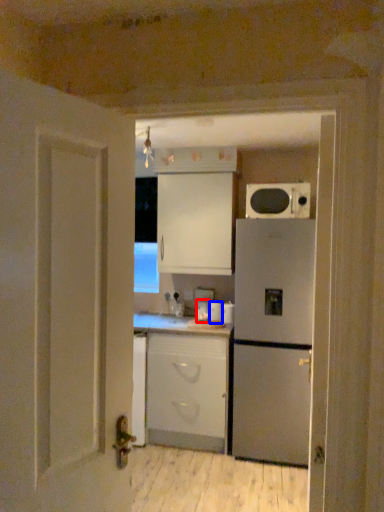
Question: Which object appears farthest to the camera in this image, appliance (highlighted by a red box) or appliance (highlighted by a blue box)?

Choices:
 (A) appliance
 (B) appliance

Answer: (A)